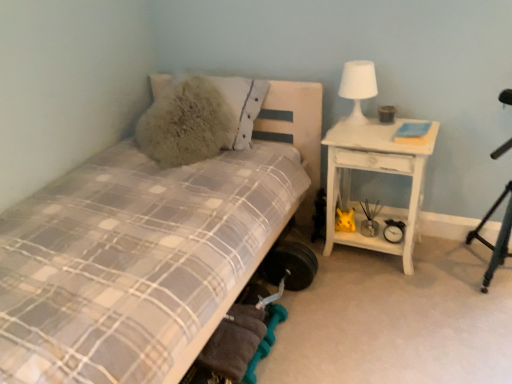
Question: Does white wood nightstand at right have a larger size compared to fuzzy beige pillow at upper left?

Choices:
 (A) yes
 (B) no

Answer: (A)

Question: Would you say white wood nightstand at right is a long distance from fuzzy beige pillow at upper left?

Choices:
 (A) yes
 (B) no

Answer: (B)

Question: Could you tell me if white wood nightstand at right is facing fuzzy beige pillow at upper left?

Choices:
 (A) no
 (B) yes

Answer: (A)

Question: Is white wood nightstand at right shorter than fuzzy beige pillow at upper left?

Choices:
 (A) yes
 (B) no

Answer: (B)

Question: Is the position of white wood nightstand at right less distant than that of fuzzy beige pillow at upper left?

Choices:
 (A) no
 (B) yes

Answer: (B)

Question: Is white matte table lamp at upper right in front of or behind white wood nightstand at right in the image?

Choices:
 (A) front
 (B) behind

Answer: (B)

Question: From a real-world perspective, relative to white wood nightstand at right, is white matte table lamp at upper right vertically above or below?

Choices:
 (A) below
 (B) above

Answer: (B)

Question: Considering the positions of white matte table lamp at upper right and white wood nightstand at right in the image, is white matte table lamp at upper right taller or shorter than white wood nightstand at right?

Choices:
 (A) tall
 (B) short

Answer: (B)

Question: Is white matte table lamp at upper right wider or thinner than white wood nightstand at right?

Choices:
 (A) wide
 (B) thin

Answer: (B)

Question: Is point (473, 233) positioned closer to the camera than point (234, 97)?

Choices:
 (A) closer
 (B) farther

Answer: (B)

Question: In the image, is teal metallic tripod at right on the left side or the right side of fuzzy beige pillow at upper left?

Choices:
 (A) left
 (B) right

Answer: (B)

Question: In terms of size, does teal metallic tripod at right appear bigger or smaller than fuzzy beige pillow at upper left?

Choices:
 (A) small
 (B) big

Answer: (A)

Question: From a real-world perspective, is teal metallic tripod at right physically located above or below fuzzy beige pillow at upper left?

Choices:
 (A) above
 (B) below

Answer: (B)

Question: Considering the positions of fuzzy beige pillow at upper left and white wood nightstand at right in the image, is fuzzy beige pillow at upper left taller or shorter than white wood nightstand at right?

Choices:
 (A) tall
 (B) short

Answer: (B)

Question: Considering the positions of fuzzy beige pillow at upper left and white wood nightstand at right in the image, is fuzzy beige pillow at upper left bigger or smaller than white wood nightstand at right?

Choices:
 (A) big
 (B) small

Answer: (B)